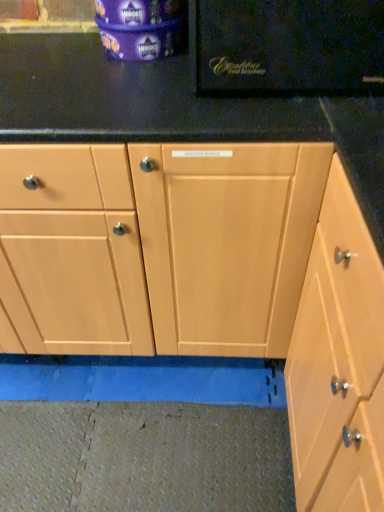
What do you see at coordinates (338, 362) in the screenshot? The height and width of the screenshot is (512, 384). I see `light wood cabinet at center` at bounding box center [338, 362].

Identify the location of light wood cabinet at center. The height and width of the screenshot is (512, 384). (338, 362).

At what (x,y) coordinates should I click in order to perform the action: click on light wood cabinet at center. Please return your answer as a coordinate pair (x, y). Looking at the image, I should click on pyautogui.click(x=338, y=362).